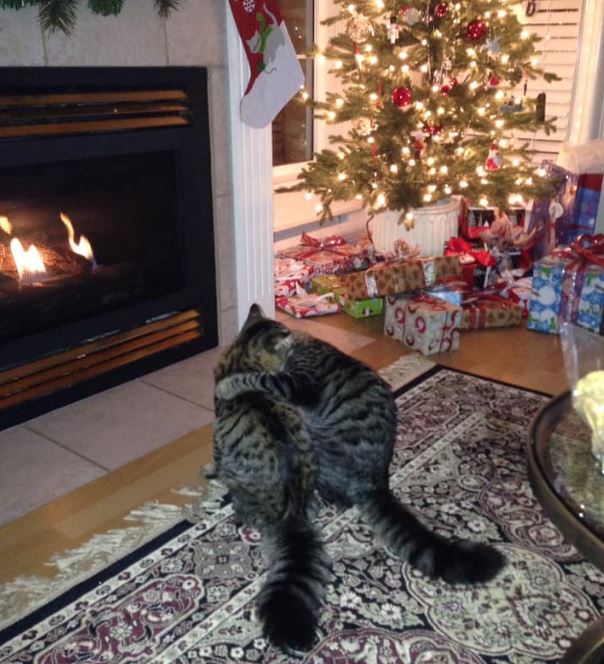
Locate an element on the screen. glass tabletop is located at coordinates (568, 454).